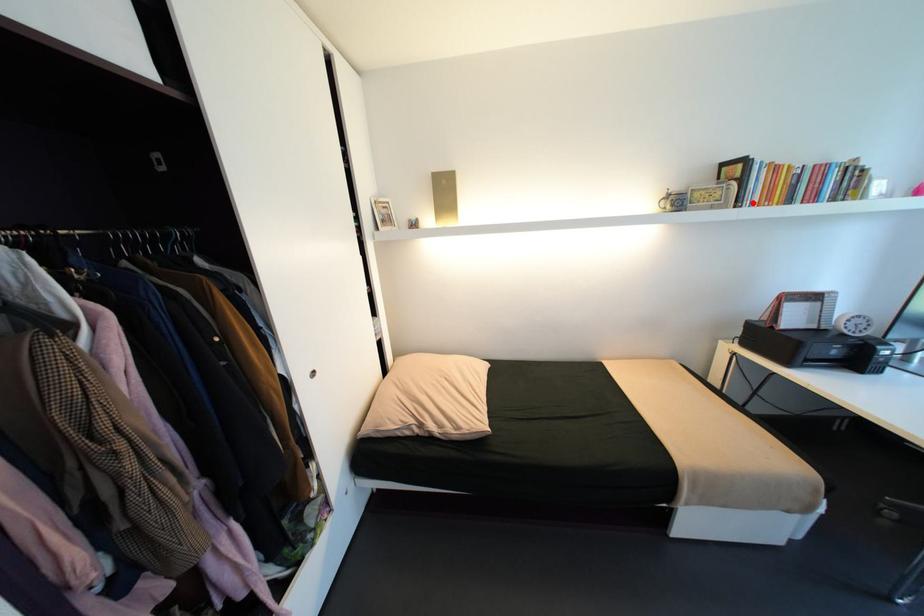
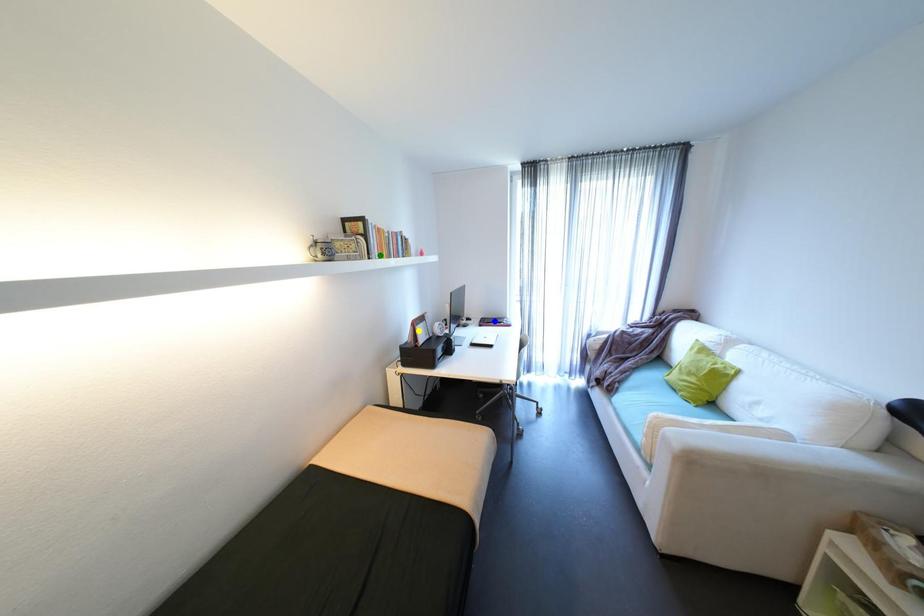
Question: I am providing you with two images of the same scene from different viewpoints. A red point is marked on the first image. You are given multiple points on the second image. Which spot in image 2 lines up with the point in image 1?

Choices:
 (A) green point
 (B) blue point
 (C) yellow point

Answer: (A)